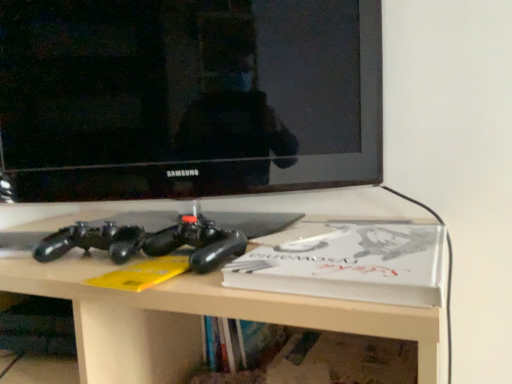
Find the location of `white matte paperback book at center`. white matte paperback book at center is located at coordinates (350, 264).

What do you see at coordinates (188, 97) in the screenshot? Image resolution: width=512 pixels, height=384 pixels. I see `black glossy television at upper center` at bounding box center [188, 97].

Locate an element on the screen. The image size is (512, 384). matte black controller at center is located at coordinates (197, 319).

Is matte black controller at center smaller than black glossy television at upper center?

No.

How many degrees apart are the facing directions of matte black controller at center and black glossy television at upper center?

The angular difference between matte black controller at center and black glossy television at upper center is 21.7 degrees.

In terms of width, does matte black controller at center look wider or thinner when compared to black glossy television at upper center?

matte black controller at center is wider than black glossy television at upper center.

From a real-world perspective, is matte black controller at center positioned above or below black glossy television at upper center?

matte black controller at center is situated lower than black glossy television at upper center in the real world.

Considering the relative sizes of matte black controller at center and white matte paperback book at center in the image provided, is matte black controller at center thinner than white matte paperback book at center?

In fact, matte black controller at center might be wider than white matte paperback book at center.

Is matte black controller at center far from white matte paperback book at center?

matte black controller at center is actually quite close to white matte paperback book at center.

Is matte black controller at center oriented away from white matte paperback book at center?

matte black controller at center does not have its back to white matte paperback book at center.

Which is behind, point (257, 242) or point (413, 270)?

The point (257, 242) is more distant.

Which object is further away from the camera taking this photo, black glossy television at upper center or matte black controller at center?

black glossy television at upper center is behind.

From a real-world perspective, which is physically above, black glossy television at upper center or matte black controller at center?

From a 3D spatial view, black glossy television at upper center is above.

Is black glossy television at upper center outside of matte black controller at center?

black glossy television at upper center is positioned outside matte black controller at center.

Does white matte paperback book at center touch matte black controller at center?

No, white matte paperback book at center is not making contact with matte black controller at center.

From the image's perspective, is white matte paperback book at center on matte black controller at center?

Yes.

This screenshot has height=384, width=512. I want to click on paperback book that is on the right side of matte black controller at center, so click(x=350, y=264).

Is the depth of white matte paperback book at center greater than that of matte black controller at center?

Yes, the depth of white matte paperback book at center is greater than that of matte black controller at center.

Can you confirm if black glossy television at upper center is positioned to the left of white matte paperback book at center?

Indeed, black glossy television at upper center is positioned on the left side of white matte paperback book at center.

Considering the sizes of objects black glossy television at upper center and white matte paperback book at center in the image provided, who is bigger, black glossy television at upper center or white matte paperback book at center?

black glossy television at upper center is bigger.

From the image's perspective, which object appears higher, white matte paperback book at center or black glossy television at upper center?

black glossy television at upper center appears higher in the image.

Does white matte paperback book at center have a larger size compared to black glossy television at upper center?

Actually, white matte paperback book at center might be smaller than black glossy television at upper center.

In terms of width, does white matte paperback book at center look wider or thinner when compared to black glossy television at upper center?

In the image, white matte paperback book at center appears to be wider than black glossy television at upper center.

The width and height of the screenshot is (512, 384). In the image, there is a black glossy television at upper center. Identify the location of desk below it (from the image's perspective). (197, 319).

The width and height of the screenshot is (512, 384). Identify the location of paperback book behind the matte black controller at center. (350, 264).

When comparing their distances from black glossy television at upper center, does white matte paperback book at center or matte black controller at center seem further?

Among the two, white matte paperback book at center is located further to black glossy television at upper center.

Considering their positions, is black glossy television at upper center positioned further to white matte paperback book at center than matte black controller at center?

The object further to white matte paperback book at center is black glossy television at upper center.

From the image, which object appears to be nearer to matte black controller at center, white matte paperback book at center or black glossy television at upper center?

white matte paperback book at center is positioned closer to the anchor matte black controller at center.

When comparing their distances from white matte paperback book at center, does matte black controller at center or black glossy television at upper center seem further?

black glossy television at upper center is positioned further to the anchor white matte paperback book at center.

In the scene shown: When comparing their distances from matte black controller at center, does black glossy television at upper center or white matte paperback book at center seem closer?

white matte paperback book at center lies closer to matte black controller at center than the other object.

From the image, which object appears to be farther from black glossy television at upper center, matte black controller at center or white matte paperback book at center?

The object further to black glossy television at upper center is white matte paperback book at center.

What are the coordinates of `paperback book between black glossy television at upper center and matte black controller at center vertically` in the screenshot? It's located at (350, 264).